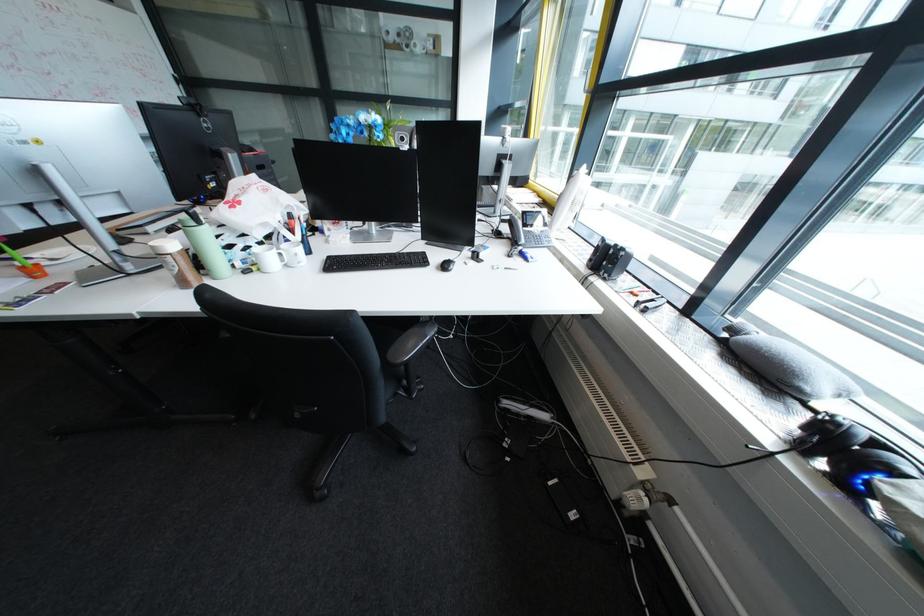
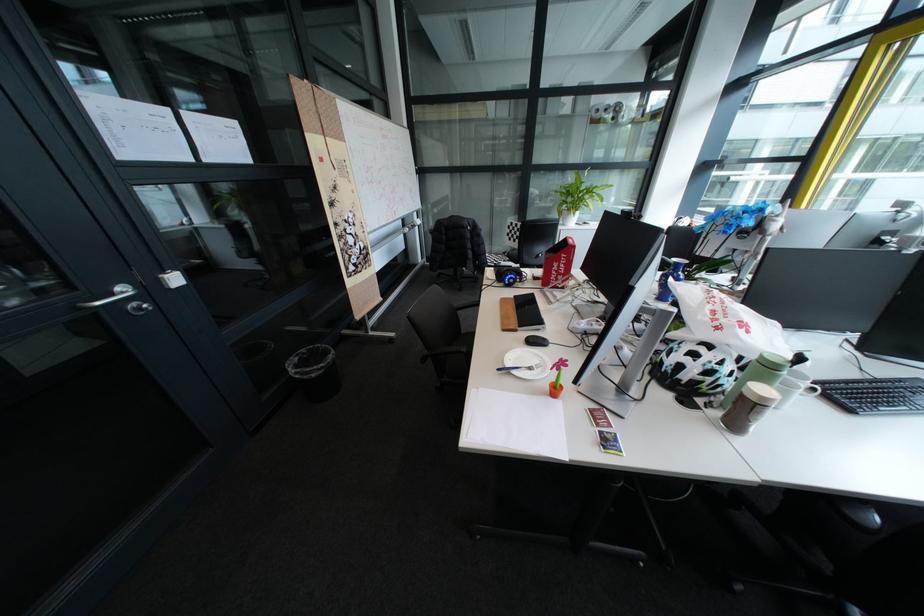
Where in the second image is the point corresponding to [288,251] from the first image?

(815, 386)